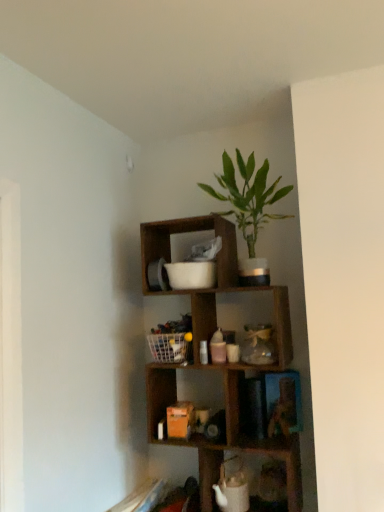
Question: Is white mesh basket at center positioned beyond the bounds of green leafy plant in pot at upper center?

Choices:
 (A) no
 (B) yes

Answer: (B)

Question: Is white mesh basket at center turned away from green leafy plant in pot at upper center?

Choices:
 (A) no
 (B) yes

Answer: (A)

Question: From the image's perspective, is white mesh basket at center beneath green leafy plant in pot at upper center?

Choices:
 (A) no
 (B) yes

Answer: (B)

Question: Does white mesh basket at center have a lesser height compared to green leafy plant in pot at upper center?

Choices:
 (A) yes
 (B) no

Answer: (A)

Question: Can you confirm if white mesh basket at center is smaller than green leafy plant in pot at upper center?

Choices:
 (A) no
 (B) yes

Answer: (B)

Question: Does point (253, 450) appear closer or farther from the camera than point (168, 323)?

Choices:
 (A) closer
 (B) farther

Answer: (A)

Question: Considering the positions of wooden cube at upper center and white mesh basket at center in the image, is wooden cube at upper center bigger or smaller than white mesh basket at center?

Choices:
 (A) small
 (B) big

Answer: (B)

Question: In terms of height, does wooden cube at upper center look taller or shorter compared to white mesh basket at center?

Choices:
 (A) tall
 (B) short

Answer: (A)

Question: Is wooden cube at upper center situated inside white mesh basket at center or outside?

Choices:
 (A) inside
 (B) outside

Answer: (B)

Question: Does point (218, 177) appear closer or farther from the camera than point (162, 442)?

Choices:
 (A) closer
 (B) farther

Answer: (B)

Question: Considering the positions of green leafy plant in pot at upper center and wooden cube at upper center in the image, is green leafy plant in pot at upper center taller or shorter than wooden cube at upper center?

Choices:
 (A) tall
 (B) short

Answer: (B)

Question: From the image's perspective, is green leafy plant in pot at upper center positioned above or below wooden cube at upper center?

Choices:
 (A) below
 (B) above

Answer: (B)

Question: Is green leafy plant in pot at upper center inside the boundaries of wooden cube at upper center, or outside?

Choices:
 (A) outside
 (B) inside

Answer: (A)

Question: From a real-world perspective, is white mesh basket at center physically located above or below wooden cube at upper center?

Choices:
 (A) below
 (B) above

Answer: (B)

Question: Considering the positions of point (160, 326) and point (173, 396), is point (160, 326) closer or farther from the camera than point (173, 396)?

Choices:
 (A) farther
 (B) closer

Answer: (B)